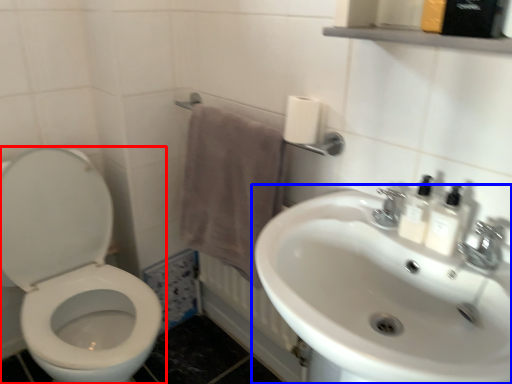
Question: Which object is closer to the camera taking this photo, toilet (highlighted by a red box) or sink (highlighted by a blue box)?

Choices:
 (A) toilet
 (B) sink

Answer: (B)